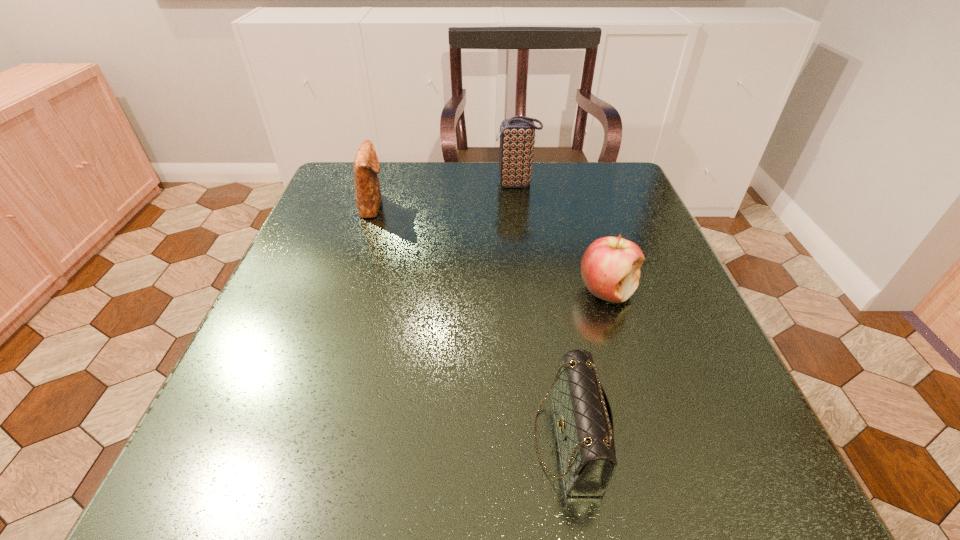
This screenshot has height=540, width=960. Find the location of `vacant space situated with the zip open on the farthest clutch bag`. vacant space situated with the zip open on the farthest clutch bag is located at coordinates (344, 184).

Find the location of a particular element. The width and height of the screenshot is (960, 540). vacant area located 0.370m on the open side of the second farthest clutch bag is located at coordinates (547, 206).

Image resolution: width=960 pixels, height=540 pixels. In order to click on blank area located on the left of the apple in this screenshot , I will do `click(544, 291)`.

Where is `free space located on the front flap of the shortest object`? free space located on the front flap of the shortest object is located at coordinates (437, 439).

Where is `free space located 0.390m on the front flap of the shortest object`? free space located 0.390m on the front flap of the shortest object is located at coordinates (242, 439).

Find the location of a particular element. The image size is (960, 540). free space located on the front flap of the shortest object is located at coordinates (399, 439).

At what (x,y) coordinates should I click in order to perform the action: click on object located in the near edge section of the desktop. Please return your answer as a coordinate pair (x, y). This screenshot has height=540, width=960. Looking at the image, I should click on coord(584,419).

You are a GUI agent. You are given a task and a screenshot of the screen. Output one action in this format:
    pyautogui.click(x=<x>, y=<y>)
    Task: Click on the object situated at the left edge
    The width and height of the screenshot is (960, 540).
    Given the screenshot: What is the action you would take?
    pyautogui.click(x=366, y=165)

Locate an element on the screen. object located in the right edge section of the desktop is located at coordinates (610, 267).

I want to click on object that is at the far left corner, so click(366, 165).